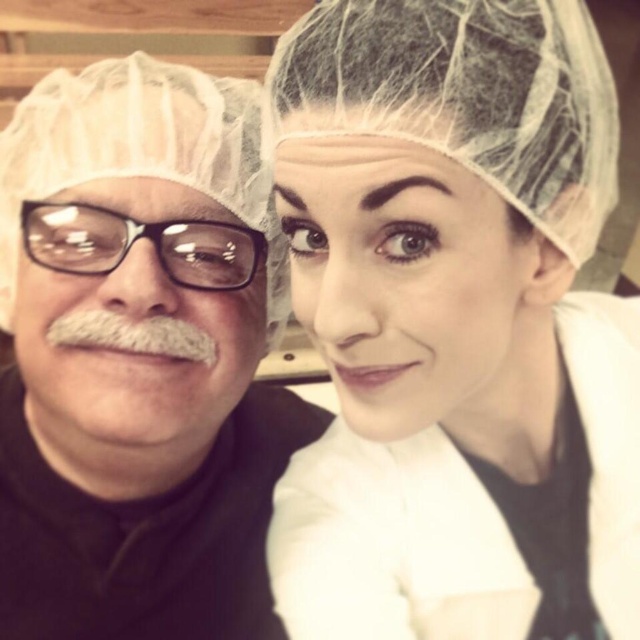
In the scene shown: You are a customer at a bakery and see the transparent plastic glasses at left and the white fuzzy mustache at left. Which one is larger in size?

The transparent plastic glasses at left are bigger than the white fuzzy mustache at left.

You are taking a photo of the two people in the kitchen. You want to focus on the white mesh hairnet at upper center and the matte black hair at left. Which object should you adjust your camera focus to first to ensure both are in focus?

The white mesh hairnet at upper center is in front of the matte black hair at left, so you should focus on the matte black hair at left first to ensure both are in focus.

You are taking a photo of the person on the left. You want to ensure that both the matte black hair at left and the transparent plastic glasses at left are clearly visible. Which object should you focus on first to make sure the other is also in focus?

The matte black hair at left is below transparent plastic glasses at left. Since they are positioned vertically close to each other, focusing on either one should keep both in focus.